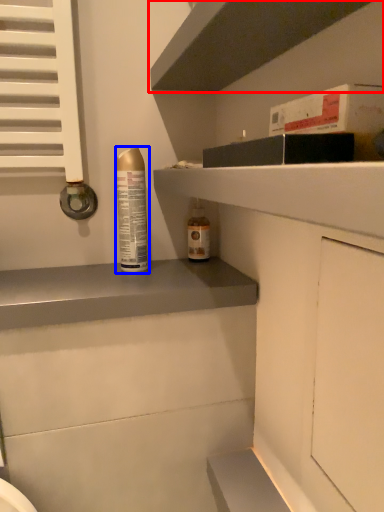
Question: Which of the following is the closest to the observer, shelf (highlighted by a red box) or bottle (highlighted by a blue box)?

Choices:
 (A) shelf
 (B) bottle

Answer: (A)